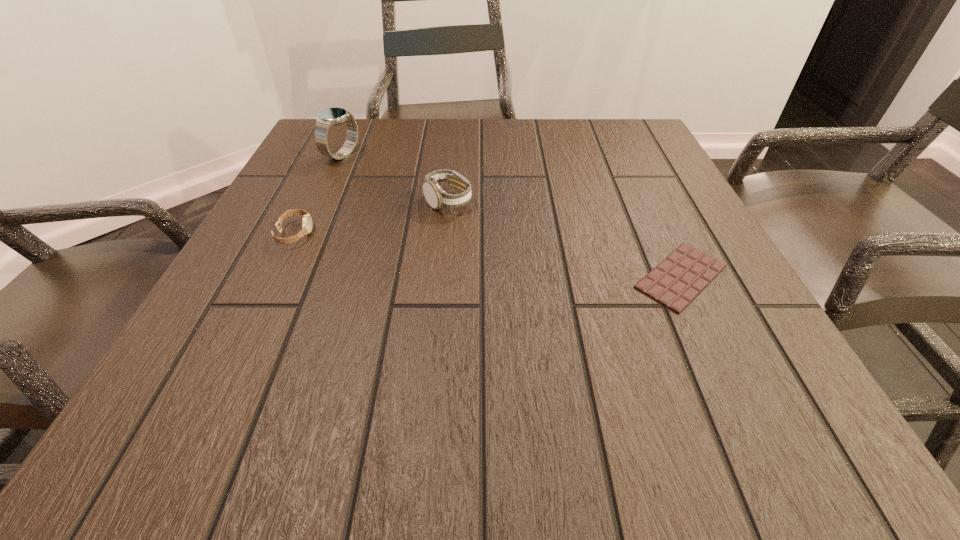
The width and height of the screenshot is (960, 540). Find the location of `vacant space that is in between the farthest watch and the rightmost object`. vacant space that is in between the farthest watch and the rightmost object is located at coordinates (512, 215).

Identify the location of vacant space that's between the second shortest object and the third shortest object. (372, 217).

Locate an element on the screen. This screenshot has height=540, width=960. vacant space in between the chocolate bar and the second nearest watch is located at coordinates [564, 239].

Where is `the second closest object to the chocolate bar`? the second closest object to the chocolate bar is located at coordinates (307, 220).

Find the location of a particular element. The width and height of the screenshot is (960, 540). object that stands as the second closest to the farthest watch is located at coordinates (307, 220).

Identify the location of watch that stands as the second closest to the chocolate bar. The image size is (960, 540). (307, 220).

Point out which watch is positioned as the second nearest to the nearest watch. Please provide its 2D coordinates. Your answer should be formatted as a tuple, i.e. [(x, y)], where the tuple contains the x and y coordinates of a point satisfying the conditions above.

[(436, 197)]

Find the location of a particular element. Image resolution: width=960 pixels, height=540 pixels. vacant space that satisfies the following two spatial constraints: 1. on the face of the second tallest watch; 2. on the face of the shortest watch is located at coordinates (444, 234).

The height and width of the screenshot is (540, 960). Find the location of `free location that satisfies the following two spatial constraints: 1. on the face of the shortest object; 2. on the right side of the second shortest watch`. free location that satisfies the following two spatial constraints: 1. on the face of the shortest object; 2. on the right side of the second shortest watch is located at coordinates (x=441, y=276).

Find the location of `free space that satisfies the following two spatial constraints: 1. on the face of the third tallest object; 2. on the back side of the rightmost object`. free space that satisfies the following two spatial constraints: 1. on the face of the third tallest object; 2. on the back side of the rightmost object is located at coordinates (275, 276).